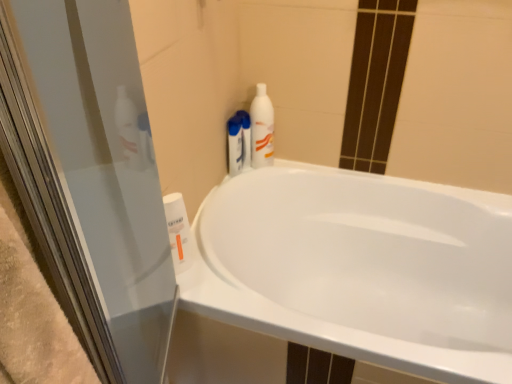
Question: Does white glossy bottle at upper right, which is the second cleaning product from front to back, appear on the left side of white glossy bathtub at center?

Choices:
 (A) no
 (B) yes

Answer: (B)

Question: Is white glossy bottle at upper right, which is counted as the third cleaning product, starting from the left, positioned behind white glossy bathtub at center?

Choices:
 (A) no
 (B) yes

Answer: (B)

Question: From a real-world perspective, is white glossy bottle at upper right, the second cleaning product viewed from the back, positioned under white glossy bathtub at center based on gravity?

Choices:
 (A) no
 (B) yes

Answer: (A)

Question: Is white glossy bottle at upper right, the second cleaning product viewed from the back, not inside white glossy bathtub at center?

Choices:
 (A) yes
 (B) no

Answer: (A)

Question: Is white glossy bottle at upper right, which is the 3th cleaning product in bottom-to-top order, wider than white glossy bathtub at center?

Choices:
 (A) no
 (B) yes

Answer: (A)

Question: Can you confirm if white glossy bottle at upper right, the first cleaning product viewed from the right, is bigger than white glossy bathtub at center?

Choices:
 (A) no
 (B) yes

Answer: (A)

Question: From the image's perspective, is white glossy bottle at upper right, which is the 3th cleaning product in bottom-to-top order, beneath white glossy bottle at upper right, positioned as the 2th cleaning product in right-to-left order?

Choices:
 (A) yes
 (B) no

Answer: (B)

Question: Considering the relative sizes of white glossy bottle at upper right, the first cleaning product viewed from the right, and white glossy bottle at upper right, positioned as the 2th cleaning product in right-to-left order, in the image provided, is white glossy bottle at upper right, the first cleaning product viewed from the right, taller than white glossy bottle at upper right, positioned as the 2th cleaning product in right-to-left order,?

Choices:
 (A) no
 (B) yes

Answer: (B)

Question: Are white glossy bottle at upper right, the second cleaning product viewed from the back, and white glossy bottle at upper right, the 1th cleaning product viewed from the back, beside each other?

Choices:
 (A) no
 (B) yes

Answer: (B)

Question: Is white glossy bottle at upper right, which is counted as the third cleaning product, starting from the left, shorter than white glossy bottle at upper right, the 1th cleaning product viewed from the back?

Choices:
 (A) yes
 (B) no

Answer: (B)

Question: From the image's perspective, is white glossy bottle at upper right, which appears as the 1th cleaning product when viewed from the top, over white glossy bottle at upper right, the third cleaning product when ordered from front to back?

Choices:
 (A) no
 (B) yes

Answer: (B)

Question: Is white glossy bottle at upper right, which appears as the 1th cleaning product when viewed from the top, not near white glossy bottle at upper right, which appears as the 2th cleaning product when viewed from the top?

Choices:
 (A) no
 (B) yes

Answer: (A)

Question: From the image's perspective, is white glossy bottle at upper right, the 1th cleaning product viewed from the back, under white glossy bottle at upper right, which is the 3th cleaning product in bottom-to-top order?

Choices:
 (A) yes
 (B) no

Answer: (A)